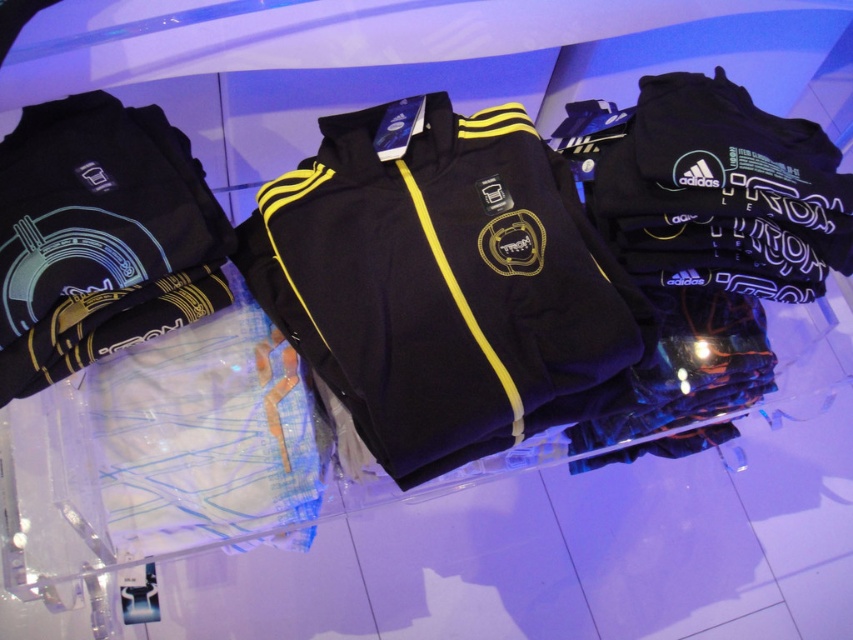
You are a customer looking at the Adidas apparel display. You see the glowing blue fabric at left and the matte black track pants at center. Which item is placed above the other?

The glowing blue fabric at left is positioned over matte black track pants at center, so the glowing blue fabric at left is above the matte black track pants at center.